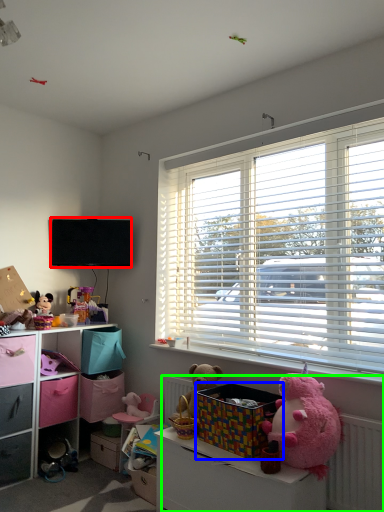
Question: Considering the real-world distances, which object is closest to television (highlighted by a red box)? storage box (highlighted by a blue box) or radiator (highlighted by a green box).

Choices:
 (A) storage box
 (B) radiator

Answer: (A)